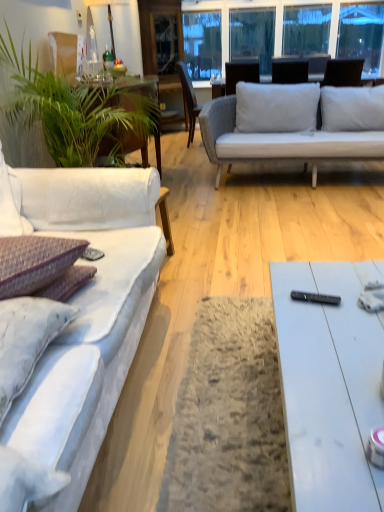
Question: Does purple textured pillow at left have a greater height compared to white glossy coffee table at lower right?

Choices:
 (A) yes
 (B) no

Answer: (B)

Question: Considering the relative sizes of purple textured pillow at left and white glossy coffee table at lower right in the image provided, is purple textured pillow at left thinner than white glossy coffee table at lower right?

Choices:
 (A) yes
 (B) no

Answer: (A)

Question: From a real-world perspective, is purple textured pillow at left positioned under white glossy coffee table at lower right based on gravity?

Choices:
 (A) yes
 (B) no

Answer: (B)

Question: Is purple textured pillow at left in front of white glossy coffee table at lower right?

Choices:
 (A) no
 (B) yes

Answer: (A)

Question: Is purple textured pillow at left oriented towards white glossy coffee table at lower right?

Choices:
 (A) yes
 (B) no

Answer: (B)

Question: Is purple textured pillow at left positioned beyond the bounds of white glossy coffee table at lower right?

Choices:
 (A) yes
 (B) no

Answer: (A)

Question: Is purple textured pillow at left shorter than transparent glass window screen at upper center?

Choices:
 (A) yes
 (B) no

Answer: (A)

Question: Considering the relative sizes of purple textured pillow at left and transparent glass window screen at upper center in the image provided, is purple textured pillow at left smaller than transparent glass window screen at upper center?

Choices:
 (A) yes
 (B) no

Answer: (A)

Question: Does purple textured pillow at left appear on the right side of transparent glass window screen at upper center?

Choices:
 (A) no
 (B) yes

Answer: (A)

Question: Is purple textured pillow at left wider than transparent glass window screen at upper center?

Choices:
 (A) no
 (B) yes

Answer: (B)

Question: Considering the relative sizes of purple textured pillow at left and transparent glass window screen at upper center in the image provided, is purple textured pillow at left thinner than transparent glass window screen at upper center?

Choices:
 (A) yes
 (B) no

Answer: (B)

Question: Could you tell me if purple textured pillow at left is facing transparent glass window screen at upper center?

Choices:
 (A) yes
 (B) no

Answer: (B)

Question: From a real-world perspective, is black plastic remote control at center physically above purple textured pillow at left?

Choices:
 (A) yes
 (B) no

Answer: (B)